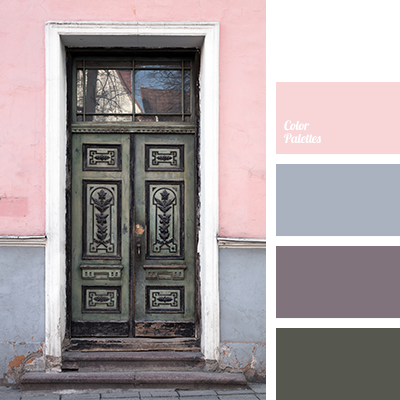
I want to click on frame, so click(57, 120).